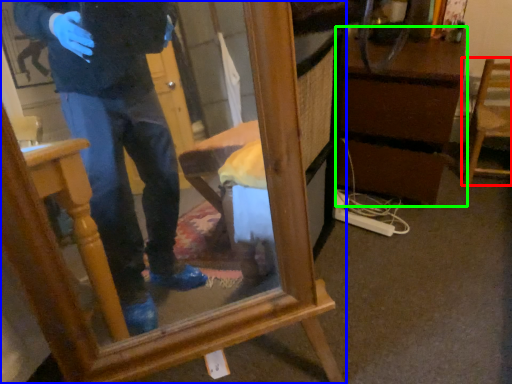
Question: Which object is the farthest from chair (highlighted by a red box)? Choose among these: furniture (highlighted by a blue box) or vanity (highlighted by a green box).

Choices:
 (A) furniture
 (B) vanity

Answer: (A)